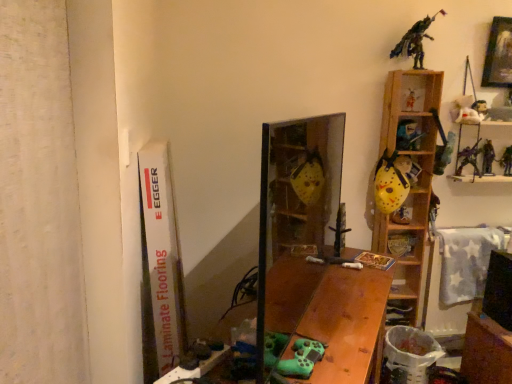
Locate an element on the screen. free space above wooden table at center, positioned as the 2th table in right-to-left order (from a real-world perspective) is located at coordinates (326, 294).